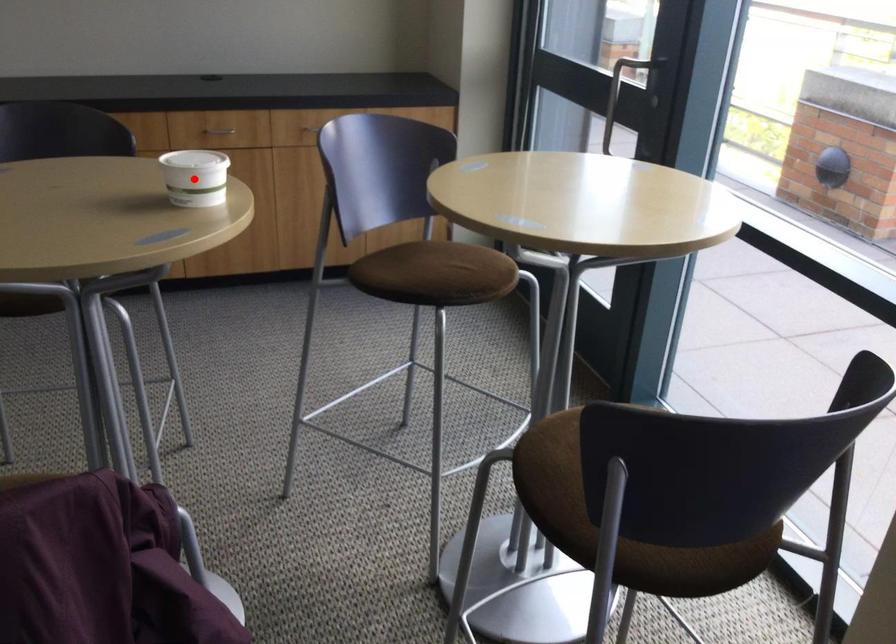
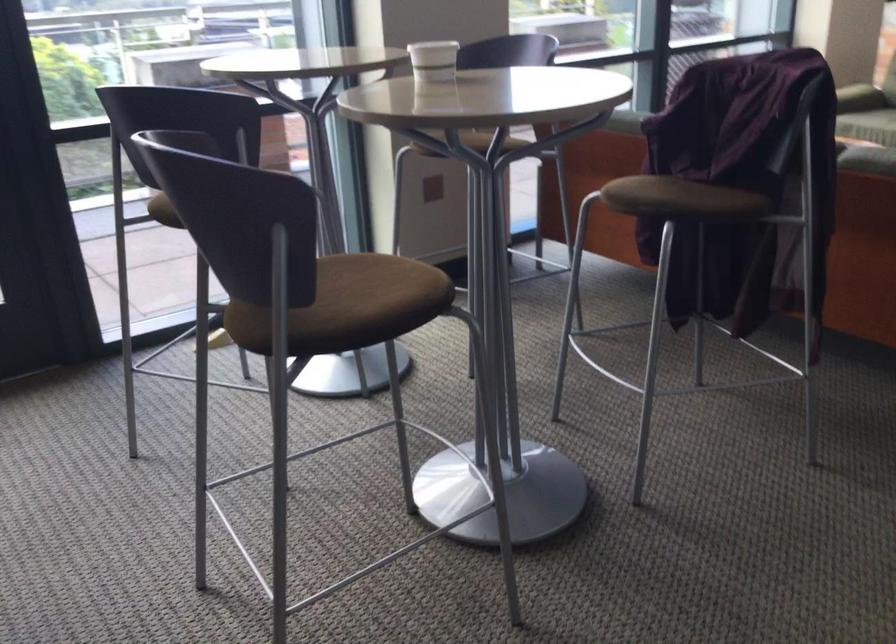
Question: I am providing you with two images of the same scene from different viewpoints. Given a red point in image1, look at the same physical point in image2. Is it:

Choices:
 (A) Closer to the viewpoint
 (B) Farther from the viewpoint

Answer: (B)